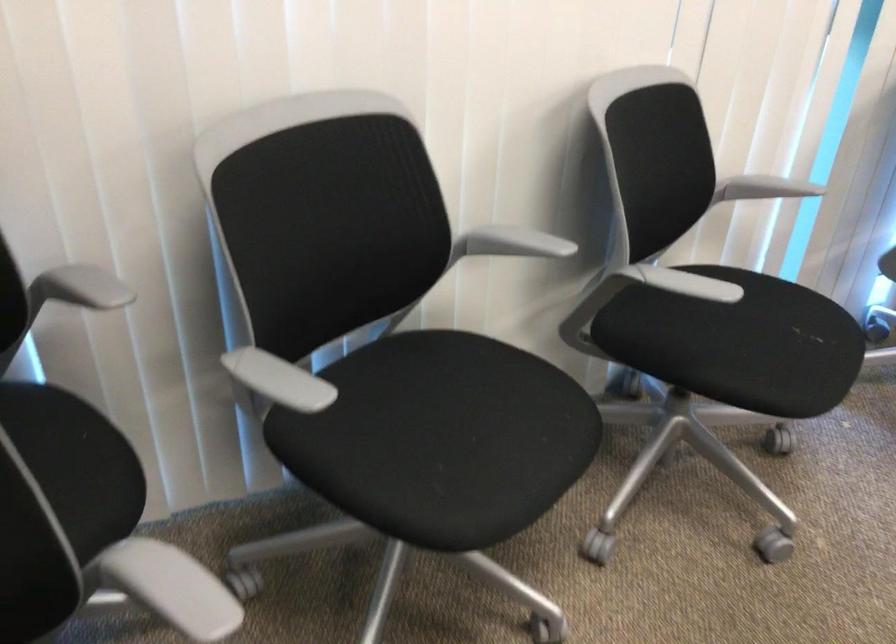
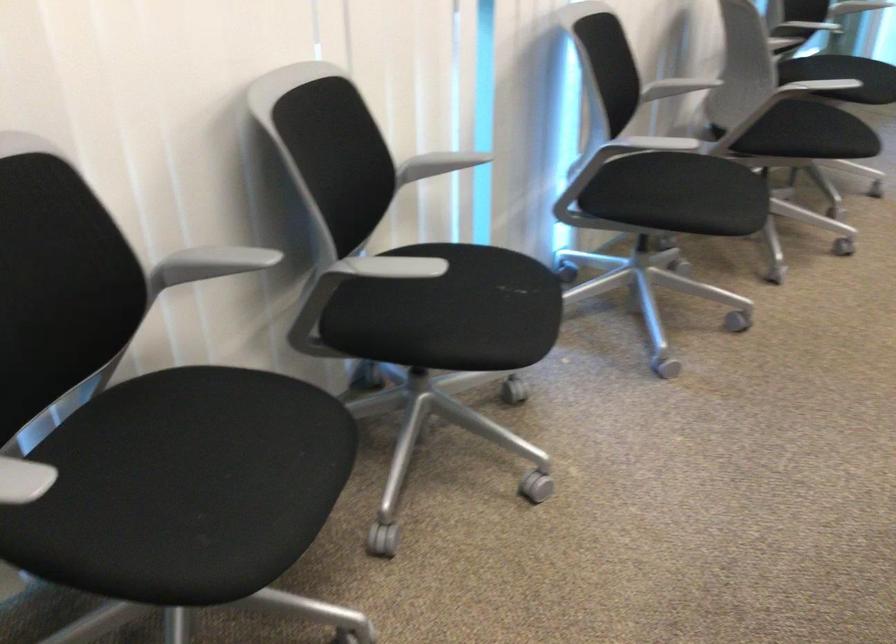
Locate, in the second image, the point that corresponds to pixel 670 283 in the first image.

(384, 267)